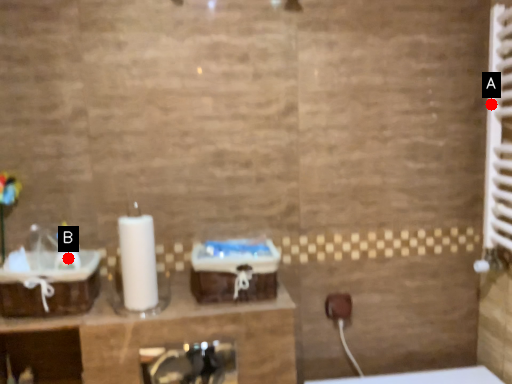
Question: Two points are circled on the image, labeled by A and B beside each circle. Which point is closer to the camera taking this photo?

Choices:
 (A) A is closer
 (B) B is closer

Answer: (B)